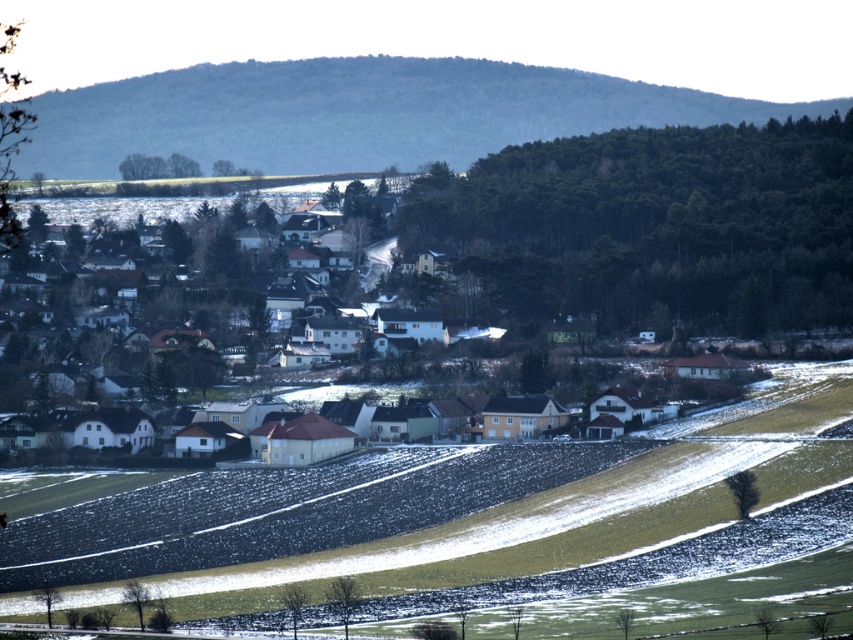
Question: Which of the following is the farthest from the observer?

Choices:
 (A) (74, 134)
 (B) (154, 305)

Answer: (A)

Question: Which point is closer to the camera?

Choices:
 (A) (201, 314)
 (B) (119, 140)

Answer: (A)

Question: Does green grassy hillside at upper center have a smaller size compared to white matte houses at center?

Choices:
 (A) yes
 (B) no

Answer: (A)

Question: Is green grassy hillside at upper center wider than white matte houses at center?

Choices:
 (A) yes
 (B) no

Answer: (A)

Question: Observing the image, what is the correct spatial positioning of green grassy hillside at upper center in reference to white matte houses at center?

Choices:
 (A) above
 (B) below

Answer: (A)